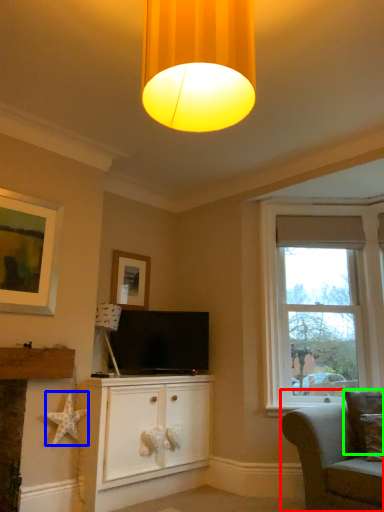
Question: Estimate the real-world distances between objects in this image. Which object is closer to studio couch (highlighted by a red box), star (highlighted by a blue box) or pillow (highlighted by a green box)?

Choices:
 (A) star
 (B) pillow

Answer: (B)